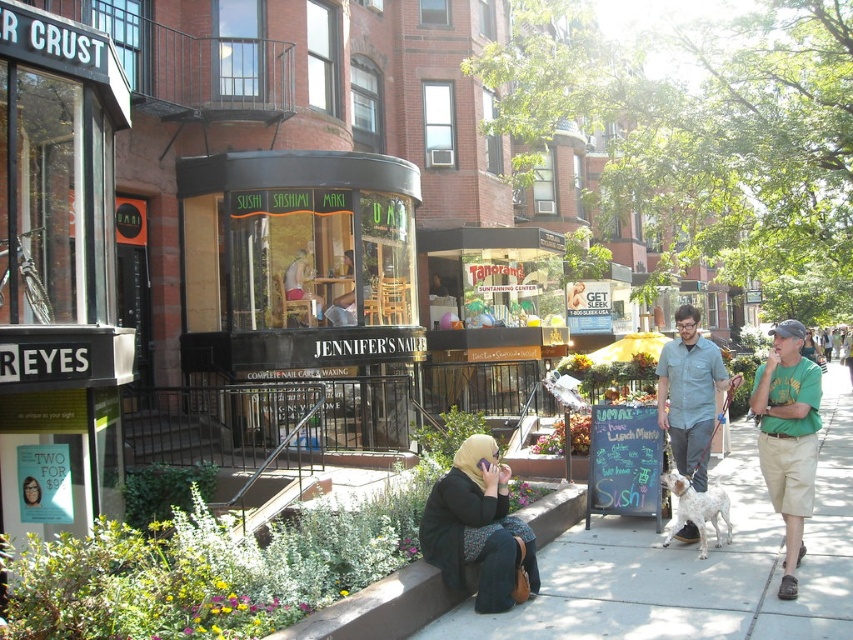
Between point (357, 179) and point (708, 403), which one is positioned in front?

Point (708, 403) is in front.

What are the coordinates of `matte black glass storefront at center` in the screenshot? It's located at (305, 280).

Is point (730, 637) closer to camera compared to point (434, 513)?

Yes, it is.

Which is below, concrete sidewalk at lower center or matte black hijab at center?

Positioned lower is concrete sidewalk at lower center.

Is point (527, 612) positioned before point (486, 545)?

No, (527, 612) is further to viewer.

Locate an element on the screen. The width and height of the screenshot is (853, 640). concrete sidewalk at lower center is located at coordinates (697, 563).

Find the location of `matte black glass storefront at center`. matte black glass storefront at center is located at coordinates (305, 280).

Does point (399, 358) come in front of point (422, 540)?

No, it is not.

Between point (374, 236) and point (519, 573), which one is positioned behind?

The point (374, 236) is more distant.

At what (x,y) coordinates should I click in order to perform the action: click on matte black glass storefront at center. Please return your answer as a coordinate pair (x, y). Looking at the image, I should click on (305, 280).